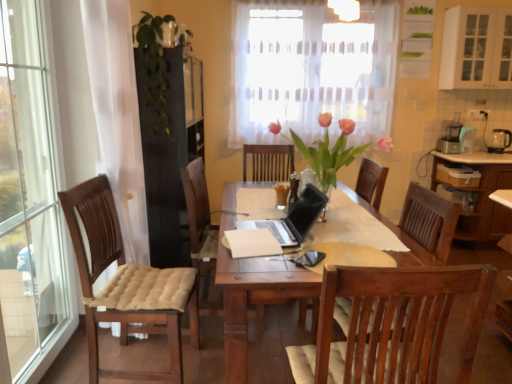
In order to face pink glass vase at center, which is the 2th floral arrangement from left to right, should I rotate leftwards or rightwards?

Turn right by 10.008 degrees to look at pink glass vase at center, which is the 2th floral arrangement from left to right.

Find the location of `black matte laptop at center`. black matte laptop at center is located at coordinates (293, 219).

Where is `green leafy plant at upper left, positioned as the 2th floral arrangement in bottom-to-top order`? green leafy plant at upper left, positioned as the 2th floral arrangement in bottom-to-top order is located at coordinates (154, 69).

This screenshot has height=384, width=512. What do you see at coordinates (499, 140) in the screenshot? I see `black glass kettle at right` at bounding box center [499, 140].

What do you see at coordinates (476, 48) in the screenshot? This screenshot has height=384, width=512. I see `white matte cabinet at upper right, which ranks as the first cabinetry in top-to-bottom order` at bounding box center [476, 48].

At what (x,y) coordinates should I click in order to perform the action: click on translucent fabric curtain at upper center. Please return your answer as a coordinate pair (x, y). The height and width of the screenshot is (384, 512). Looking at the image, I should click on (311, 71).

Is white matte cabinet at upper right, positioned as the second cabinetry in bottom-to-top order, positioned with its back to green leafy plant at upper left, positioned as the 2th floral arrangement in bottom-to-top order?

white matte cabinet at upper right, positioned as the second cabinetry in bottom-to-top order, does not have its back to green leafy plant at upper left, positioned as the 2th floral arrangement in bottom-to-top order.

From the image's perspective, relative to green leafy plant at upper left, the second floral arrangement when ordered from right to left, is white matte cabinet at upper right, which ranks as the first cabinetry in top-to-bottom order, above or below?

Based on their image positions, white matte cabinet at upper right, which ranks as the first cabinetry in top-to-bottom order, is located above green leafy plant at upper left, the second floral arrangement when ordered from right to left.

Which is more distant, (482, 54) or (154, 130)?

Positioned behind is point (482, 54).

How different are the orientations of white matte cabinet at upper right, which ranks as the first cabinetry in top-to-bottom order, and green leafy plant at upper left, arranged as the 1th floral arrangement when viewed from the left, in degrees?

white matte cabinet at upper right, which ranks as the first cabinetry in top-to-bottom order, and green leafy plant at upper left, arranged as the 1th floral arrangement when viewed from the left, are facing 90.2 degrees away from each other.

Is translucent fabric curtain at upper center not close to white matte cabinet at upper right, positioned as the second cabinetry in bottom-to-top order?

No, translucent fabric curtain at upper center is not far away from white matte cabinet at upper right, positioned as the second cabinetry in bottom-to-top order.

Is translucent fabric curtain at upper center inside the boundaries of white matte cabinet at upper right, positioned as the second cabinetry in bottom-to-top order, or outside?

translucent fabric curtain at upper center is located beyond the bounds of white matte cabinet at upper right, positioned as the second cabinetry in bottom-to-top order.

Between translucent fabric curtain at upper center and white matte cabinet at upper right, positioned as the second cabinetry in bottom-to-top order, which one is positioned behind?

translucent fabric curtain at upper center is further away from the camera.

Is translucent fabric curtain at upper center turned away from white matte cabinet at upper right, which ranks as the first cabinetry in top-to-bottom order?

No, translucent fabric curtain at upper center is not facing away from white matte cabinet at upper right, which ranks as the first cabinetry in top-to-bottom order.

From a real-world perspective, is green leafy plant at upper left, positioned as the 2th floral arrangement in bottom-to-top order, under black matte laptop at center?

Incorrect, from a real-world perspective, green leafy plant at upper left, positioned as the 2th floral arrangement in bottom-to-top order, is higher than black matte laptop at center.

Who is taller, green leafy plant at upper left, the 2th floral arrangement in the front-to-back sequence, or black matte laptop at center?

Standing taller between the two is green leafy plant at upper left, the 2th floral arrangement in the front-to-back sequence.

Is green leafy plant at upper left, arranged as the 1th floral arrangement when viewed from the left, oriented away from black matte laptop at center?

No, black matte laptop at center is not at the back of green leafy plant at upper left, arranged as the 1th floral arrangement when viewed from the left.

From the image's perspective, is green leafy plant at upper left, which ranks as the 1th floral arrangement in back-to-front order, positioned above or below black matte laptop at center?

From the image's perspective, green leafy plant at upper left, which ranks as the 1th floral arrangement in back-to-front order, appears above black matte laptop at center.

From the image's perspective, which one is positioned lower, black glass kettle at right or white matte cabinet at upper right, which ranks as the first cabinetry in top-to-bottom order?

black glass kettle at right is shown below in the image.

Is black glass kettle at right inside the boundaries of white matte cabinet at upper right, positioned as the second cabinetry in bottom-to-top order, or outside?

black glass kettle at right is located beyond the bounds of white matte cabinet at upper right, positioned as the second cabinetry in bottom-to-top order.

Which object is more forward, black glass kettle at right or white matte cabinet at upper right, which ranks as the first cabinetry in top-to-bottom order?

white matte cabinet at upper right, which ranks as the first cabinetry in top-to-bottom order.

Considering the relative sizes of black glass kettle at right and white matte cabinet at upper right, which ranks as the first cabinetry in top-to-bottom order, in the image provided, is black glass kettle at right thinner than white matte cabinet at upper right, which ranks as the first cabinetry in top-to-bottom order,?

Yes, black glass kettle at right is thinner than white matte cabinet at upper right, which ranks as the first cabinetry in top-to-bottom order.

From the image's perspective, which is below, wooden cabinet at right, positioned as the second cabinetry in top-to-bottom order, or green leafy plant at upper left, the 2th floral arrangement in the front-to-back sequence?

wooden cabinet at right, positioned as the second cabinetry in top-to-bottom order, is shown below in the image.

Is wooden cabinet at right, positioned as the second cabinetry in top-to-bottom order, behind green leafy plant at upper left, which appears as the first floral arrangement when viewed from the top?

Yes, the depth of wooden cabinet at right, positioned as the second cabinetry in top-to-bottom order, is greater than that of green leafy plant at upper left, which appears as the first floral arrangement when viewed from the top.

Is wooden cabinet at right, the 1th cabinetry when ordered from bottom to top, smaller than green leafy plant at upper left, the 2th floral arrangement in the front-to-back sequence?

Incorrect, wooden cabinet at right, the 1th cabinetry when ordered from bottom to top, is not smaller in size than green leafy plant at upper left, the 2th floral arrangement in the front-to-back sequence.

Is wooden cabinet at right, positioned as the second cabinetry in top-to-bottom order, positioned with its back to green leafy plant at upper left, positioned as the 2th floral arrangement in bottom-to-top order?

No, wooden cabinet at right, positioned as the second cabinetry in top-to-bottom order,'s orientation is not away from green leafy plant at upper left, positioned as the 2th floral arrangement in bottom-to-top order.

Would you say black matte laptop at center is inside or outside green leafy plant at upper left, arranged as the 1th floral arrangement when viewed from the left?

black matte laptop at center exists outside the volume of green leafy plant at upper left, arranged as the 1th floral arrangement when viewed from the left.

Can you confirm if black matte laptop at center is taller than green leafy plant at upper left, which appears as the first floral arrangement when viewed from the top?

In fact, black matte laptop at center may be shorter than green leafy plant at upper left, which appears as the first floral arrangement when viewed from the top.

From the image's perspective, would you say black matte laptop at center is shown under green leafy plant at upper left, the 2th floral arrangement in the front-to-back sequence?

Yes, from the image's perspective, black matte laptop at center is beneath green leafy plant at upper left, the 2th floral arrangement in the front-to-back sequence.

Based on the photo, are wooden cabinet at right, the 1th cabinetry when ordered from bottom to top, and pink glass vase at center, which appears as the second floral arrangement when viewed from the top, far apart?

Absolutely, wooden cabinet at right, the 1th cabinetry when ordered from bottom to top, is distant from pink glass vase at center, which appears as the second floral arrangement when viewed from the top.

Which point is more distant from viewer, (485,221) or (297,145)?

The point (485,221) is more distant.

Considering the sizes of wooden cabinet at right, the 1th cabinetry when ordered from bottom to top, and pink glass vase at center, the 1th floral arrangement from the right, in the image, is wooden cabinet at right, the 1th cabinetry when ordered from bottom to top, bigger or smaller than pink glass vase at center, the 1th floral arrangement from the right,?

Considering their sizes, wooden cabinet at right, the 1th cabinetry when ordered from bottom to top, takes up more space than pink glass vase at center, the 1th floral arrangement from the right.

How many degrees apart are the facing directions of wooden cabinet at right, positioned as the second cabinetry in top-to-bottom order, and pink glass vase at center, which is counted as the 1th floral arrangement, starting from the bottom?

wooden cabinet at right, positioned as the second cabinetry in top-to-bottom order, and pink glass vase at center, which is counted as the 1th floral arrangement, starting from the bottom, are facing 94.5 degrees away from each other.

From a real-world perspective, count 1st floral arrangements downward from the white matte cabinet at upper right, which ranks as the first cabinetry in top-to-bottom order, and point to it. Please provide its 2D coordinates.

[(154, 69)]

I want to click on the 1st cabinetry to the right when counting from the translucent fabric curtain at upper center, so click(x=476, y=48).

From the picture: Looking at the image, which one is located further to translucent fabric curtain at upper center, black matte laptop at center or wooden cabinet at right, the 1th cabinetry when ordered from bottom to top?

Among the two, black matte laptop at center is located further to translucent fabric curtain at upper center.

Looking at the image, which one is located closer to wooden cabinet at right, the 1th cabinetry when ordered from bottom to top, white matte cabinet at upper right, which ranks as the first cabinetry in top-to-bottom order, or black matte laptop at center?

white matte cabinet at upper right, which ranks as the first cabinetry in top-to-bottom order, is positioned closer to the anchor wooden cabinet at right, the 1th cabinetry when ordered from bottom to top.

Which object lies further to the anchor point black matte laptop at center, white matte cabinet at upper right, positioned as the second cabinetry in bottom-to-top order, or black glass kettle at right?

black glass kettle at right is further to black matte laptop at center.

Estimate the real-world distances between objects in this image. Which object is closer to white matte cabinet at upper right, which ranks as the first cabinetry in top-to-bottom order, black glass kettle at right or green leafy plant at upper left, which ranks as the 1th floral arrangement in back-to-front order?

black glass kettle at right.

Looking at the image, which one is located closer to green leafy plant at upper left, the 2th floral arrangement in the front-to-back sequence, white matte cabinet at upper right, positioned as the second cabinetry in bottom-to-top order, or wooden cabinet at right, the 1th cabinetry when ordered from bottom to top?

white matte cabinet at upper right, positioned as the second cabinetry in bottom-to-top order, is positioned closer to the anchor green leafy plant at upper left, the 2th floral arrangement in the front-to-back sequence.

Based on their spatial positions, is black glass kettle at right or translucent fabric curtain at upper center further from green leafy plant at upper left, which ranks as the 1th floral arrangement in back-to-front order?

Based on the image, black glass kettle at right appears to be further to green leafy plant at upper left, which ranks as the 1th floral arrangement in back-to-front order.

Based on their spatial positions, is translucent fabric curtain at upper center or wooden cabinet at right, the 1th cabinetry when ordered from bottom to top, closer to white matte cabinet at upper right, which ranks as the first cabinetry in top-to-bottom order?

Based on the image, wooden cabinet at right, the 1th cabinetry when ordered from bottom to top, appears to be nearer to white matte cabinet at upper right, which ranks as the first cabinetry in top-to-bottom order.

From the image, which object appears to be farther from pink glass vase at center, the 1th floral arrangement from the right, white matte cabinet at upper right, which ranks as the first cabinetry in top-to-bottom order, or green leafy plant at upper left, positioned as the 2th floral arrangement in bottom-to-top order?

white matte cabinet at upper right, which ranks as the first cabinetry in top-to-bottom order, lies further to pink glass vase at center, the 1th floral arrangement from the right, than the other object.

In order to click on tableware between white matte cabinet at upper right, positioned as the second cabinetry in bottom-to-top order, and wooden cabinet at right, the 1th cabinetry when ordered from bottom to top, in the vertical direction in this screenshot , I will do `click(499, 140)`.

In order to click on laptop between green leafy plant at upper left, arranged as the 1th floral arrangement when viewed from the left, and white matte cabinet at upper right, positioned as the second cabinetry in bottom-to-top order, from left to right in this screenshot , I will do `click(293, 219)`.

The height and width of the screenshot is (384, 512). Find the location of `curtain situated between green leafy plant at upper left, the second floral arrangement when ordered from right to left, and wooden cabinet at right, positioned as the second cabinetry in top-to-bottom order, from left to right`. curtain situated between green leafy plant at upper left, the second floral arrangement when ordered from right to left, and wooden cabinet at right, positioned as the second cabinetry in top-to-bottom order, from left to right is located at coordinates (311, 71).

This screenshot has height=384, width=512. What are the coordinates of `laptop between green leafy plant at upper left, the second floral arrangement when ordered from right to left, and wooden cabinet at right, positioned as the second cabinetry in top-to-bottom order, from left to right` in the screenshot? It's located at pyautogui.click(x=293, y=219).